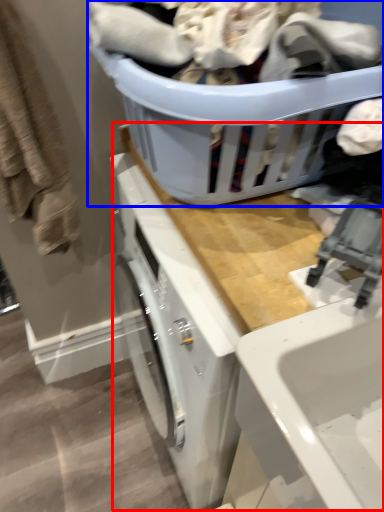
Question: Among these objects, which one is farthest to the camera, counter top (highlighted by a red box) or basket (highlighted by a blue box)?

Choices:
 (A) counter top
 (B) basket

Answer: (A)